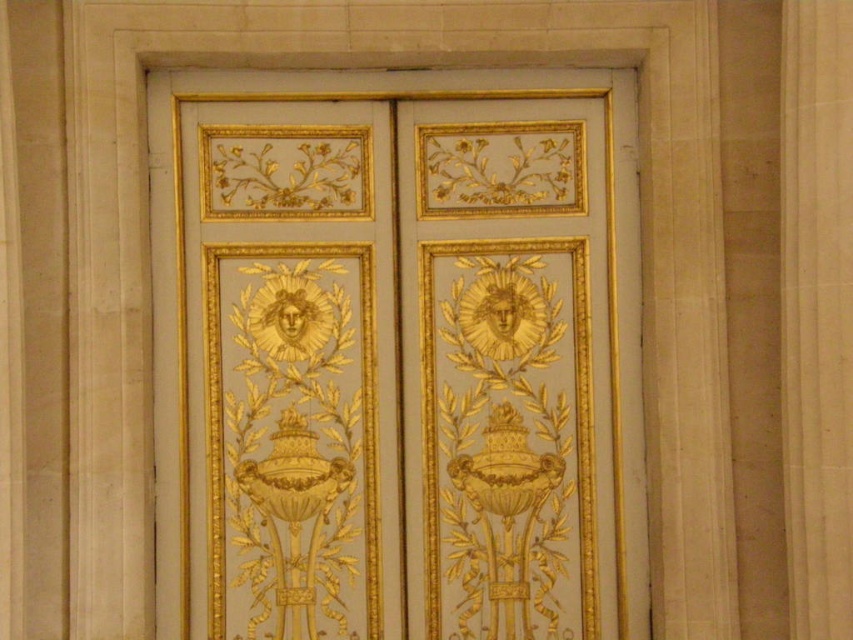
Is point (234, 490) positioned after point (804, 296)?

Yes, point (234, 490) is behind point (804, 296).

Is gold painted wood door at center positioned before white marble pillar at center?

No, gold painted wood door at center is behind white marble pillar at center.

Between point (532, 259) and point (788, 330), which one is positioned behind?

The point (532, 259) is more distant.

You are a GUI agent. You are given a task and a screenshot of the screen. Output one action in this format:
    pyautogui.click(x=<x>, y=<y>)
    Task: Click on the gold painted wood door at center
    This screenshot has height=640, width=853.
    Given the screenshot: What is the action you would take?
    pyautogui.click(x=396, y=355)